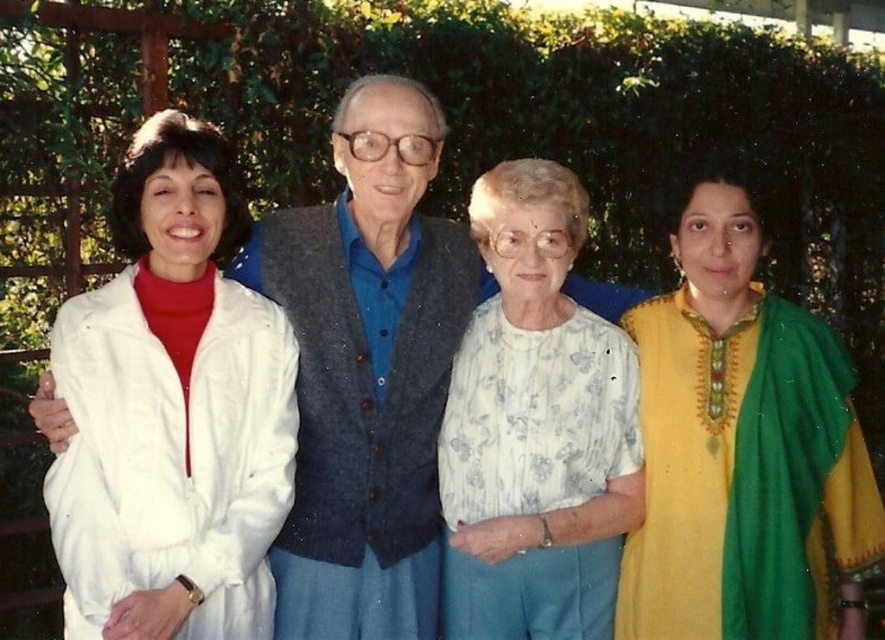
Question: Is white textured blouse at center thinner than white floral blouse at center?

Choices:
 (A) no
 (B) yes

Answer: (A)

Question: Which of these objects is positioned closest to the floral cotton blouse at center?

Choices:
 (A) white textured blouse at center
 (B) white floral blouse at center

Answer: (B)

Question: Estimate the real-world distances between objects in this image. Which object is closer to the floral cotton blouse at center?

Choices:
 (A) white textured blouse at center
 (B) white floral blouse at center

Answer: (B)

Question: Does white textured blouse at center have a lesser width compared to floral cotton blouse at center?

Choices:
 (A) no
 (B) yes

Answer: (B)

Question: Which point is closer to the camera?

Choices:
 (A) white textured blouse at center
 (B) floral cotton blouse at center
 (C) white floral blouse at center

Answer: (A)

Question: Does floral cotton blouse at center lie behind white floral blouse at center?

Choices:
 (A) no
 (B) yes

Answer: (A)